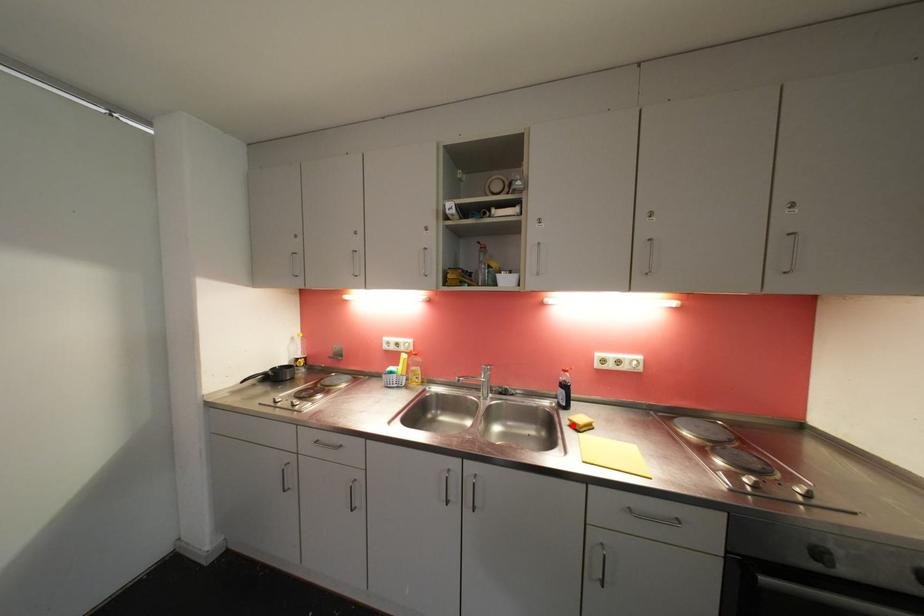
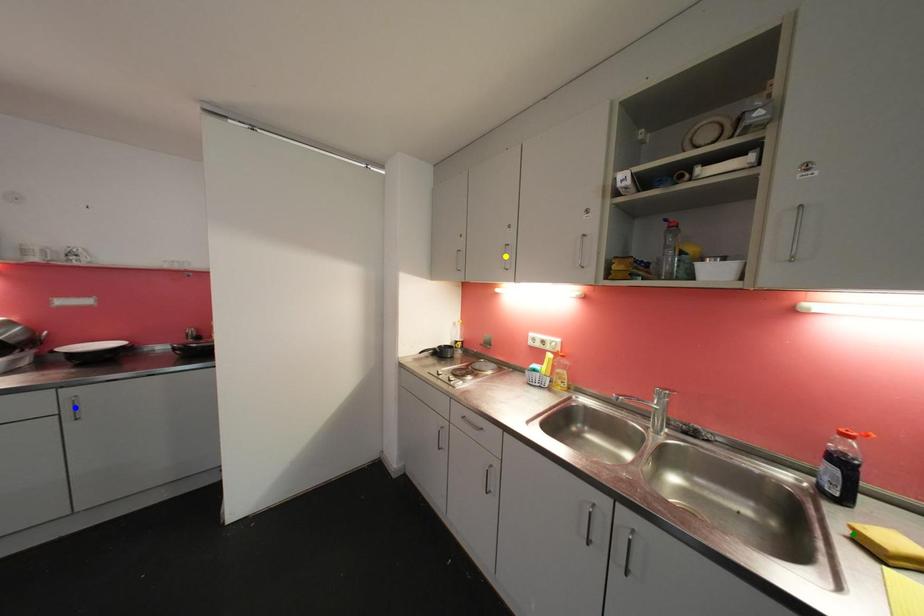
Question: I am providing you with two images of the same scene from different viewpoints. A red point is marked on the first image. You are given multiple points on the second image. Which point in image 2 represents the same 3d spot as the red point in image 1?

Choices:
 (A) green point
 (B) yellow point
 (C) blue point

Answer: (A)